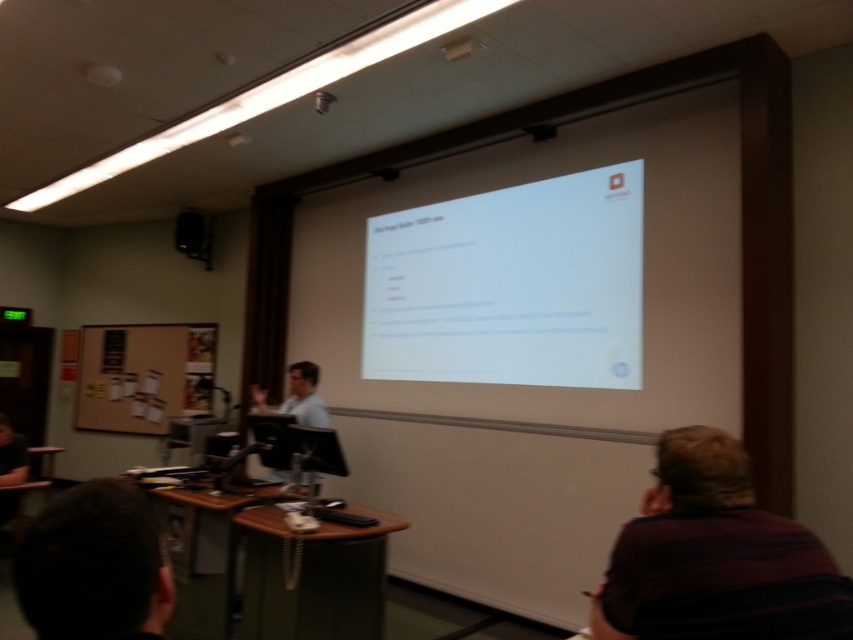
Between point (480, 256) and point (662, 468), which one is positioned in front?

Point (662, 468) is in front.

Who is shorter, white matte projector screen at center or striped sweater at lower right?

striped sweater at lower right

Does point (384, 236) come in front of point (675, 499)?

That is False.

Where is `white matte projector screen at center`? The image size is (853, 640). white matte projector screen at center is located at coordinates (511, 285).

Does white matte projector screen at center lie behind white shirt at center?

No.

Who is taller, white matte projector screen at center or white shirt at center?

white matte projector screen at center

Locate an element on the screen. The width and height of the screenshot is (853, 640). white matte projector screen at center is located at coordinates (511, 285).

The height and width of the screenshot is (640, 853). Find the location of `white matte projector screen at center`. white matte projector screen at center is located at coordinates (511, 285).

Consider the image. Is striped sweater at lower right smaller than white shirt at center?

Yes.

Can you confirm if striped sweater at lower right is positioned to the right of white shirt at center?

Correct, you'll find striped sweater at lower right to the right of white shirt at center.

Between point (672, 460) and point (294, 419), which one is positioned behind?

The point (294, 419) is more distant.

Locate an element on the screen. The image size is (853, 640). striped sweater at lower right is located at coordinates (715, 556).